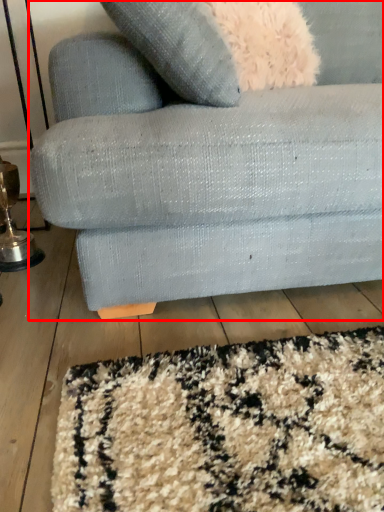
Question: From the image's perspective, where is studio couch (annotated by the red box) located in relation to table lamp in the image?

Choices:
 (A) below
 (B) above

Answer: (B)